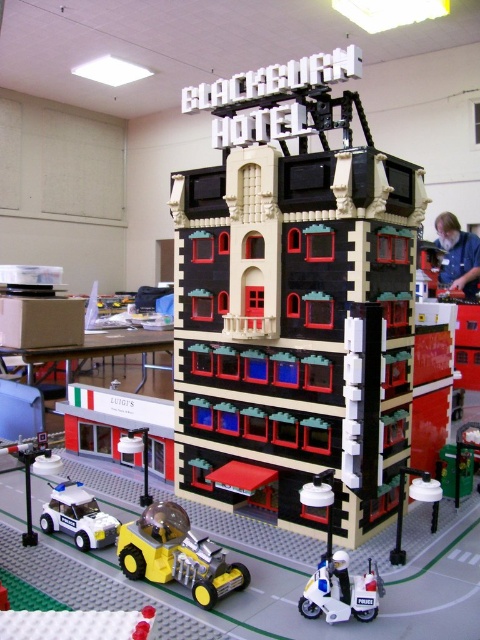
Question: Does yellow metallic toy car at center lie in front of white plastic police scooter at lower center?

Choices:
 (A) no
 (B) yes

Answer: (A)

Question: Among these objects, which one is farthest from the camera?

Choices:
 (A) yellow metallic toy car at center
 (B) white plastic police scooter at lower center

Answer: (A)

Question: Is brick-patterned hotel at center thinner than white plastic police car at lower left?

Choices:
 (A) no
 (B) yes

Answer: (A)

Question: Which object appears farthest from the camera in this image?

Choices:
 (A) yellow metallic toy car at center
 (B) white plastic police car at lower left

Answer: (B)

Question: Which is farther from the brick-patterned hotel at center?

Choices:
 (A) yellow metallic toy car at center
 (B) white plastic police car at lower left

Answer: (B)

Question: Is brick-patterned hotel at center above yellow metallic toy car at center?

Choices:
 (A) no
 (B) yes

Answer: (B)